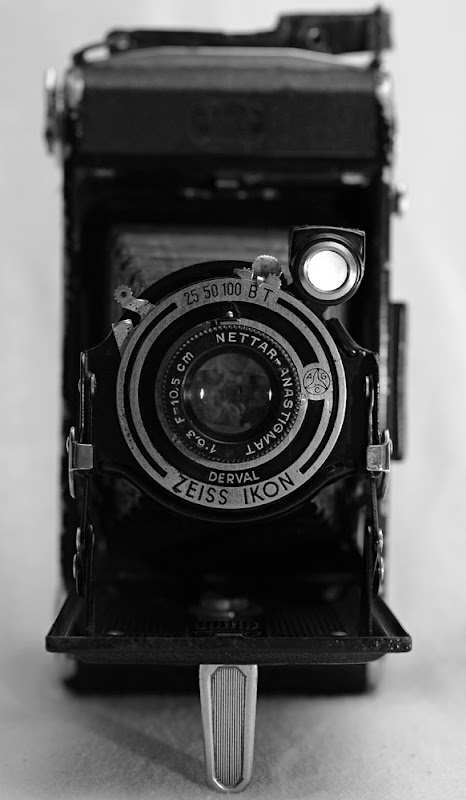
Find the location of `light casing`. light casing is located at coordinates (314, 238).